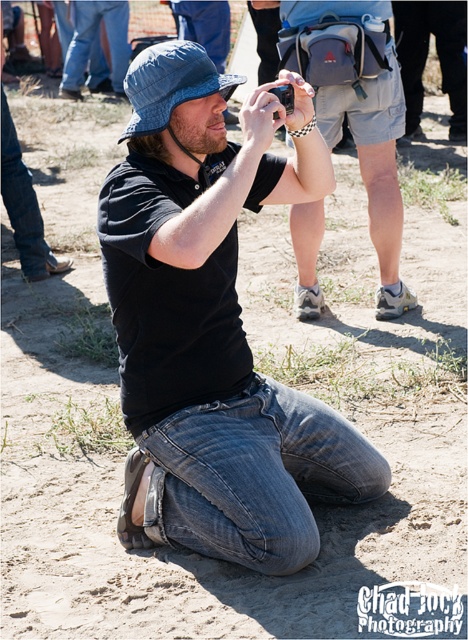
Consider the image. Can you confirm if matte black camera at center is bigger than black plastic camera at center?

Yes, matte black camera at center is bigger than black plastic camera at center.

Who is taller, matte black camera at center or black plastic camera at center?

With more height is matte black camera at center.

You are a GUI agent. You are given a task and a screenshot of the screen. Output one action in this format:
    pyautogui.click(x=<x>, y=<y>)
    Task: Click on the matte black camera at center
    
    Given the screenshot: What is the action you would take?
    pyautogui.click(x=357, y=113)

Find the location of `matte black camera at center`. matte black camera at center is located at coordinates (357, 113).

Between point (248, 408) and point (287, 96), which one is positioned behind?

Positioned behind is point (248, 408).

Is point (343, 452) positioned behind point (292, 86)?

Yes, point (343, 452) is farther from viewer.

Locate an element on the screen. denim jeans at center is located at coordinates (255, 476).

The width and height of the screenshot is (468, 640). I want to click on denim jeans at center, so click(x=255, y=476).

Does black matte camera at center have a greater height compared to denim jeans at center?

Indeed, black matte camera at center has a greater height compared to denim jeans at center.

Does black matte camera at center appear over denim jeans at center?

Yes.

Find the location of a particular element. The width and height of the screenshot is (468, 640). black matte camera at center is located at coordinates (213, 324).

The image size is (468, 640). What are the coordinates of `black matte camera at center` in the screenshot? It's located at (213, 324).